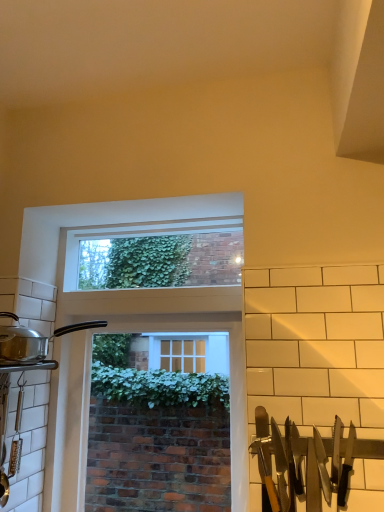
Question: Is clear glass window at upper center, which appears as the 1th window screen when viewed from the top, to the left of silver metallic pot at left from the viewer's perspective?

Choices:
 (A) no
 (B) yes

Answer: (A)

Question: Is clear glass window at upper center, acting as the 2th window screen starting from the bottom, to the right of silver metallic pot at left from the viewer's perspective?

Choices:
 (A) yes
 (B) no

Answer: (A)

Question: Is clear glass window at upper center, acting as the 2th window screen starting from the bottom, looking in the opposite direction of silver metallic pot at left?

Choices:
 (A) no
 (B) yes

Answer: (A)

Question: Does clear glass window at upper center, which appears as the 1th window screen when viewed from the top, have a smaller size compared to silver metallic pot at left?

Choices:
 (A) no
 (B) yes

Answer: (A)

Question: Is clear glass window at upper center, acting as the 2th window screen starting from the bottom, outside silver metallic pot at left?

Choices:
 (A) yes
 (B) no

Answer: (A)

Question: Considering the positions of silver/black handles at right and clear glass window at center, the first window screen from the bottom, in the image, is silver/black handles at right taller or shorter than clear glass window at center, the first window screen from the bottom,?

Choices:
 (A) short
 (B) tall

Answer: (A)

Question: Is silver/black handles at right bigger or smaller than clear glass window at center, the 2th window screen viewed from the top?

Choices:
 (A) small
 (B) big

Answer: (A)

Question: In terms of width, does silver/black handles at right look wider or thinner when compared to clear glass window at center, the first window screen from the bottom?

Choices:
 (A) thin
 (B) wide

Answer: (A)

Question: From the image's perspective, is silver/black handles at right positioned above or below clear glass window at center, the 2th window screen viewed from the top?

Choices:
 (A) below
 (B) above

Answer: (A)

Question: Considering their positions, is clear glass window at center, the first window screen from the bottom, located in front of or behind silver/black handles at right?

Choices:
 (A) front
 (B) behind

Answer: (B)

Question: Visually, is clear glass window at center, the first window screen from the bottom, positioned to the left or to the right of silver/black handles at right?

Choices:
 (A) right
 (B) left

Answer: (B)

Question: Considering the positions of clear glass window at center, the 2th window screen viewed from the top, and silver/black handles at right in the image, is clear glass window at center, the 2th window screen viewed from the top, wider or thinner than silver/black handles at right?

Choices:
 (A) wide
 (B) thin

Answer: (A)

Question: From their relative heights in the image, would you say clear glass window at center, the first window screen from the bottom, is taller or shorter than silver/black handles at right?

Choices:
 (A) short
 (B) tall

Answer: (B)

Question: From the image's perspective, is silver/black handles at right located above or below clear glass window at upper center, acting as the 2th window screen starting from the bottom?

Choices:
 (A) above
 (B) below

Answer: (B)

Question: Does point (296, 437) appear closer or farther from the camera than point (167, 280)?

Choices:
 (A) closer
 (B) farther

Answer: (A)